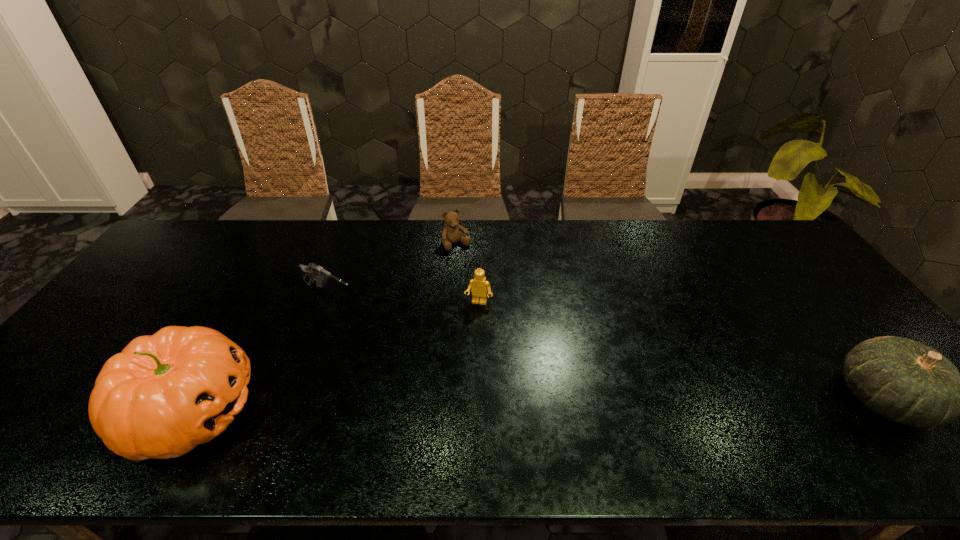
The width and height of the screenshot is (960, 540). I want to click on vacant space on the desktop that is between the pumpkin and the fourth shortest object and is positioned on the front-facing side of the teddy bear, so click(x=575, y=404).

You are a GUI agent. You are given a task and a screenshot of the screen. Output one action in this format:
    pyautogui.click(x=<x>, y=<y>)
    Task: Click on the vacant space on the desktop that is between the tallest object and the gourd and is positioned at the barrel of the gun
    
    Given the screenshot: What is the action you would take?
    pyautogui.click(x=510, y=405)

Image resolution: width=960 pixels, height=540 pixels. Identify the location of free spot on the desktop that is between the pumpkin and the gourd and is positioned on the face of the Lego. (451, 406).